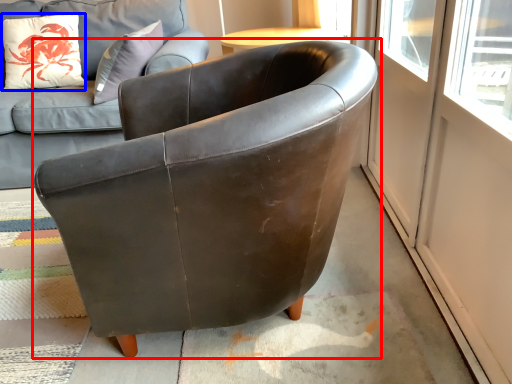
Question: Which object appears closest to the camera in this image, chair (highlighted by a red box) or pillow (highlighted by a blue box)?

Choices:
 (A) chair
 (B) pillow

Answer: (A)